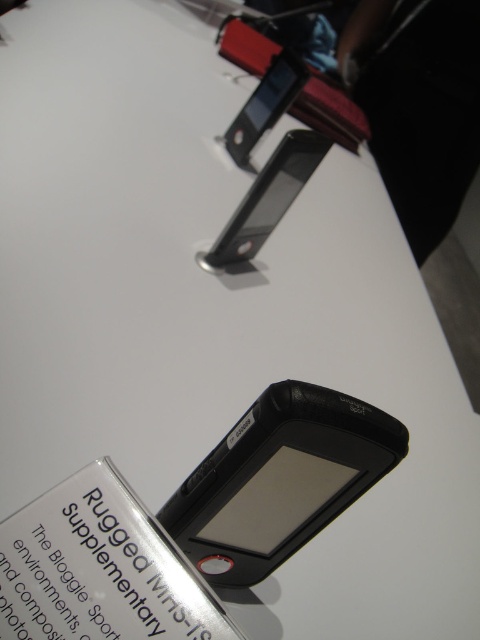
Is point (326, 147) less distant than point (235, 138)?

Yes, it is in front of point (235, 138).

This screenshot has height=640, width=480. Describe the element at coordinates (267, 198) in the screenshot. I see `black matte smartphone at upper center` at that location.

Locate an element on the screen. This screenshot has width=480, height=640. black matte smartphone at upper center is located at coordinates (267, 198).

Can you confirm if black matte gps at center is positioned below black matte smartphone at upper center?

Yes.

Between point (215, 456) and point (240, 205), which one is positioned in front?

Point (215, 456)

Where is `black matte gps at center`? This screenshot has width=480, height=640. black matte gps at center is located at coordinates (280, 477).

Which of these two, black matte gps at center or matte black phone at upper center, stands taller?

With more height is black matte gps at center.

Does point (301, 449) come behind point (276, 113)?

No, it is not.

You are a GUI agent. You are given a task and a screenshot of the screen. Output one action in this format:
    pyautogui.click(x=<x>, y=<y>)
    Task: Click on the black matte gps at center
    The width and height of the screenshot is (480, 640).
    Given the screenshot: What is the action you would take?
    pyautogui.click(x=280, y=477)